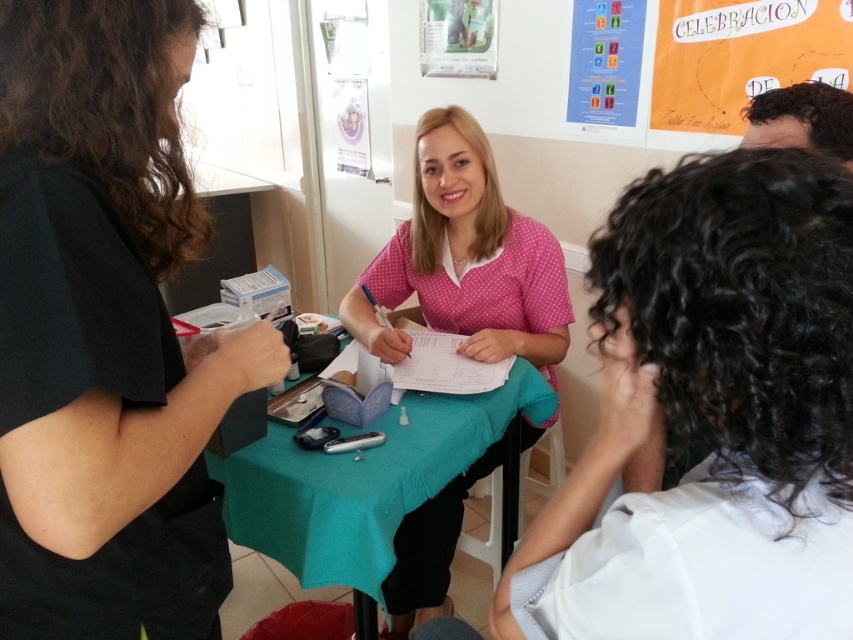
The height and width of the screenshot is (640, 853). What do you see at coordinates (105, 332) in the screenshot?
I see `black matte shirt at left` at bounding box center [105, 332].

Does black matte shirt at left appear on the left side of pink dotted shirt at center?

Yes, black matte shirt at left is to the left of pink dotted shirt at center.

Identify the location of black matte shirt at left. (105, 332).

Who is shorter, black matte shirt at left or teal fabric table at center?

With less height is teal fabric table at center.

Locate an element on the screen. This screenshot has height=640, width=853. black matte shirt at left is located at coordinates (105, 332).

Who is more forward, (128, 128) or (537, 385)?

Point (128, 128) is more forward.

Where is `black matte shirt at left`? The width and height of the screenshot is (853, 640). black matte shirt at left is located at coordinates (105, 332).

Who is lower down, pink dotted shirt at center or teal fabric table at center?

Positioned lower is teal fabric table at center.

Which is above, pink dotted shirt at center or teal fabric table at center?

pink dotted shirt at center is higher up.

Where is `pink dotted shirt at center`? The image size is (853, 640). pink dotted shirt at center is located at coordinates (465, 259).